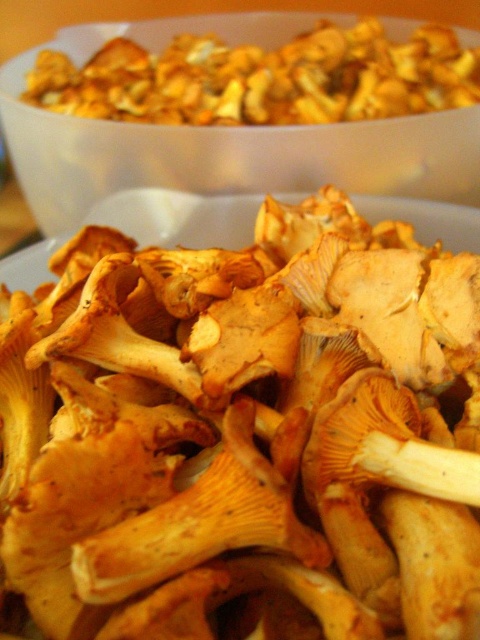
Question: Can you confirm if yellowish-brown textured mushrooms at center is positioned below yellowish-brown textured mushrooms at upper center?

Choices:
 (A) no
 (B) yes

Answer: (B)

Question: Which point appears closest to the camera in this image?

Choices:
 (A) (239, 148)
 (B) (333, 490)

Answer: (B)

Question: In this image, where is translucent plastic bowl at upper center located relative to yellowish-brown textured mushrooms at upper center?

Choices:
 (A) above
 (B) below

Answer: (B)

Question: Which of these objects is positioned closest to the yellowish-brown textured mushrooms at center?

Choices:
 (A) translucent plastic bowl at upper center
 (B) yellowish-brown textured mushrooms at upper center

Answer: (A)

Question: Can you confirm if translucent plastic bowl at upper center is positioned to the left of yellowish-brown textured mushrooms at upper center?

Choices:
 (A) no
 (B) yes

Answer: (B)

Question: Which of the following is the closest to the observer?

Choices:
 (A) (347, 413)
 (B) (322, 106)
 (C) (400, 28)

Answer: (A)